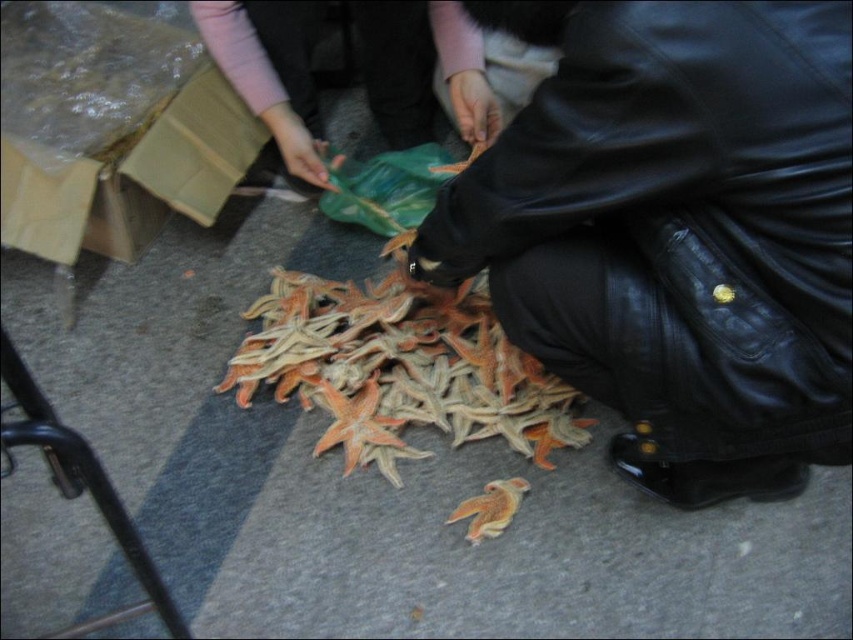
Who is more forward, (804, 220) or (248, 337)?

Point (804, 220)

Does point (741, 368) lie in front of point (369, 401)?

Yes.

Image resolution: width=853 pixels, height=640 pixels. Find the location of `leather jacket at lower right`. leather jacket at lower right is located at coordinates (675, 232).